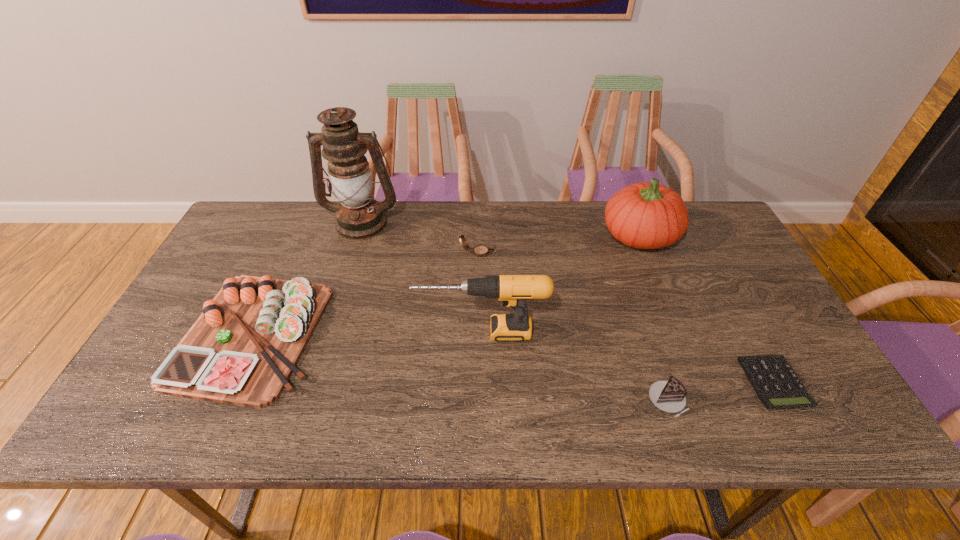
In the image, there is a desktop. Find the location of `vacant space at the far right corner`. vacant space at the far right corner is located at coordinates (684, 241).

At what (x,y) coordinates should I click in order to perform the action: click on empty space that is in between the pumpkin and the platter. Please return your answer as a coordinate pair (x, y). Looking at the image, I should click on (446, 286).

Find the location of a particular element. This screenshot has height=540, width=960. vacant area between the tallest object and the pumpkin is located at coordinates (501, 229).

Where is `free space between the shortest object and the compass`? The height and width of the screenshot is (540, 960). free space between the shortest object and the compass is located at coordinates (626, 318).

Locate an element on the screen. The image size is (960, 540). free area in between the tallest object and the pumpkin is located at coordinates (501, 229).

You are a GUI agent. You are given a task and a screenshot of the screen. Output one action in this format:
    pyautogui.click(x=<x>, y=<y>)
    Task: Click on the empty space that is in between the calculator and the pumpkin
    Image resolution: width=960 pixels, height=540 pixels.
    Given the screenshot: What is the action you would take?
    pyautogui.click(x=707, y=309)

Find the location of `free area in between the pumpkin and the chocolate cake`. free area in between the pumpkin and the chocolate cake is located at coordinates (654, 318).

Where is `vacant area that lies between the lantern and the platter`? The image size is (960, 540). vacant area that lies between the lantern and the platter is located at coordinates (307, 279).

Identify the location of free area in between the platter and the compass. (365, 294).

Locate an element on the screen. free space between the platter and the shortest object is located at coordinates (513, 359).